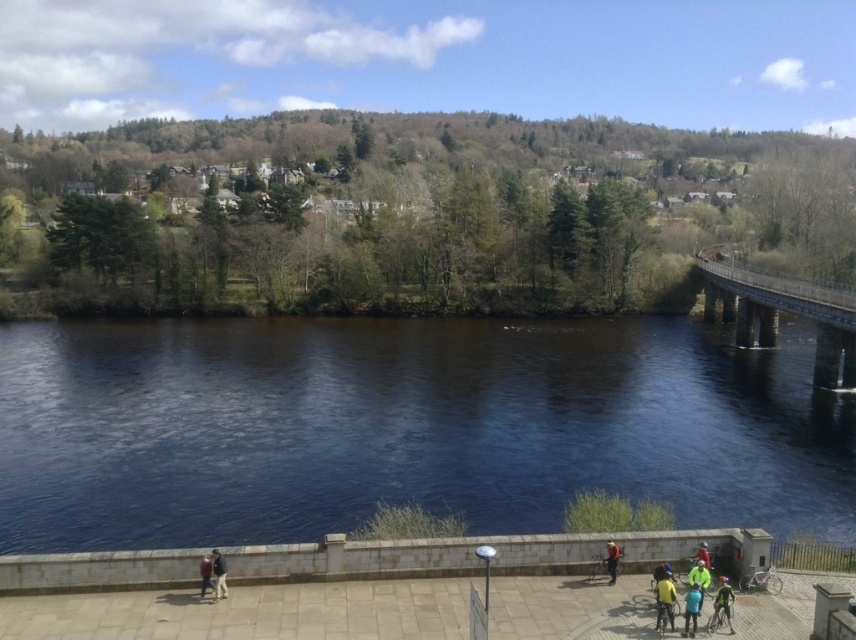
You are a photographer positioned at the lower left corner of the image. You want to capture a photo that includes the yellow fabric jacket at lower center. Which direction should you move to ensure the jacket is centered in your viewfinder?

Since the yellow fabric jacket at lower center is located at coordinates approximately 0.934 on the x and 0.777 on the y axis, you should move to the right and slightly upwards to center it in your viewfinder.

You are standing on the paved walkway and want to find the yellow jacket at lower right. Which direction should you move relative to the dark blue jeans at lower left?

The dark blue jeans at lower left is positioned on the left side of yellow jacket at lower right, so you should move to the right from the dark blue jeans at lower left to locate the yellow jacket at lower right.